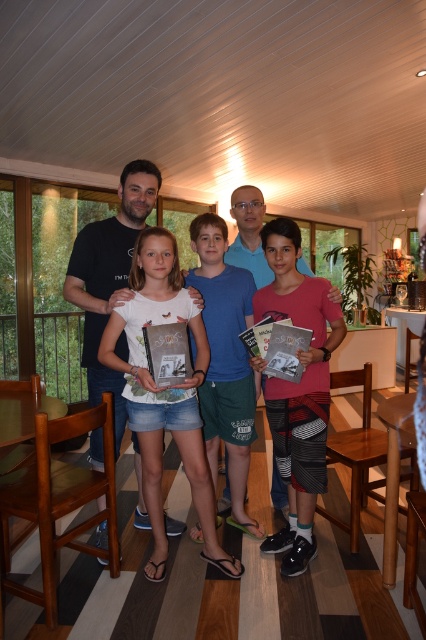
Which of these two, white cotton shirt at center or pink matte shirt at center, stands taller?

pink matte shirt at center is taller.

Is point (157, 477) positioned in front of point (284, 314)?

No, it is not.

Does point (198, 444) come behind point (319, 314)?

Yes, it is behind point (319, 314).

The height and width of the screenshot is (640, 426). I want to click on white cotton shirt at center, so click(164, 394).

Is pink matte shirt at center closer to camera compared to white cotton t-shirt at center?

Yes, it is.

Can you confirm if pink matte shirt at center is positioned below white cotton t-shirt at center?

Yes.

Does point (308, 438) come farther from viewer compared to point (80, 228)?

That is False.

Where is `pink matte shirt at center`? The width and height of the screenshot is (426, 640). pink matte shirt at center is located at coordinates (298, 388).

Which is more to the left, white cotton shirt at center or white cotton t-shirt at center?

white cotton t-shirt at center

Does white cotton shirt at center have a larger size compared to white cotton t-shirt at center?

Incorrect, white cotton shirt at center is not larger than white cotton t-shirt at center.

Does point (144, 262) come in front of point (83, 257)?

Yes, it is.

Identify the location of white cotton shirt at center. (164, 394).